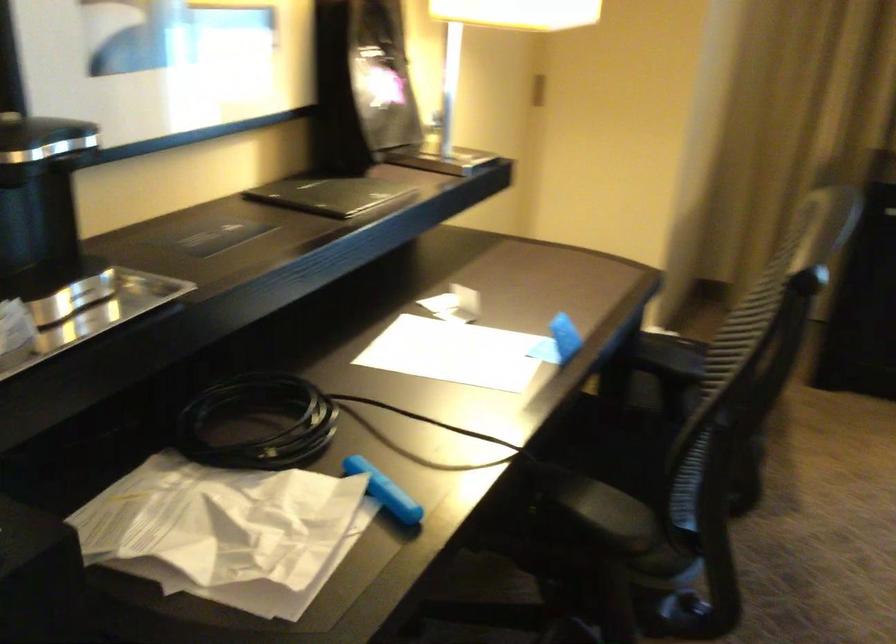
Where would you push the chair armrest? Please return your answer as a coordinate pair (x, y).

(679, 614)